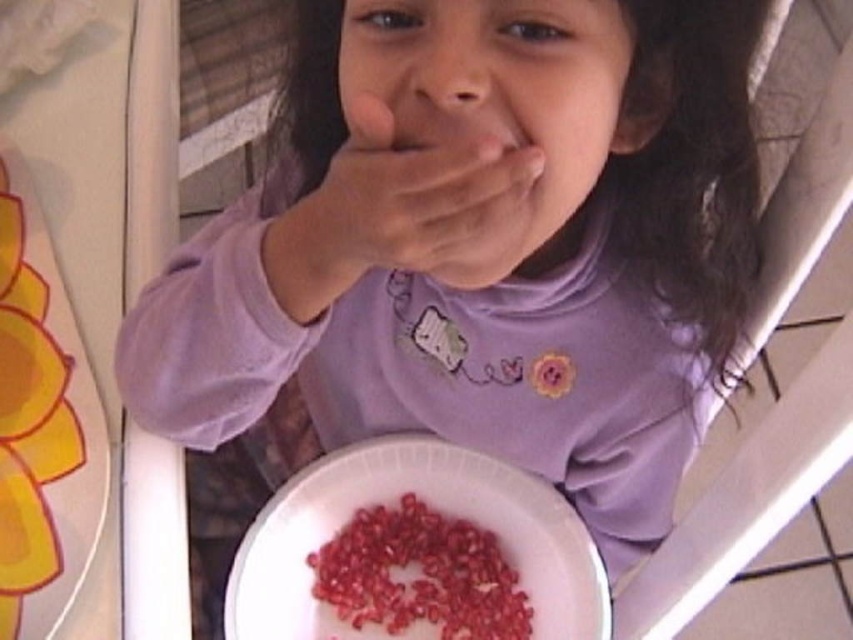
Based on the photo, is smooth skin hand at center bigger than red glossy pomegranate seeds at lower center?

Correct, smooth skin hand at center is larger in size than red glossy pomegranate seeds at lower center.

Does point (497, 237) lie behind point (460, 557)?

No, (497, 237) is closer to viewer.

Is point (345, 268) in front of point (502, 584)?

Yes, it is.

Locate an element on the screen. This screenshot has width=853, height=640. smooth skin hand at center is located at coordinates (416, 209).

Can you confirm if pomegranate seeds at center is positioned to the right of red glossy pomegranate seeds at lower center?

Yes, pomegranate seeds at center is to the right of red glossy pomegranate seeds at lower center.

Does pomegranate seeds at center appear over red glossy pomegranate seeds at lower center?

Yes.

The image size is (853, 640). What do you see at coordinates (428, 502) in the screenshot?
I see `pomegranate seeds at center` at bounding box center [428, 502].

Where is `pomegranate seeds at center`? This screenshot has height=640, width=853. pomegranate seeds at center is located at coordinates [x=428, y=502].

Does pomegranate seeds at center come behind smooth skin hand at center?

Yes, it is behind smooth skin hand at center.

The width and height of the screenshot is (853, 640). What do you see at coordinates (428, 502) in the screenshot?
I see `pomegranate seeds at center` at bounding box center [428, 502].

Which is behind, point (575, 531) or point (363, 161)?

Point (575, 531)

Identify the location of pomegranate seeds at center. The image size is (853, 640). (428, 502).